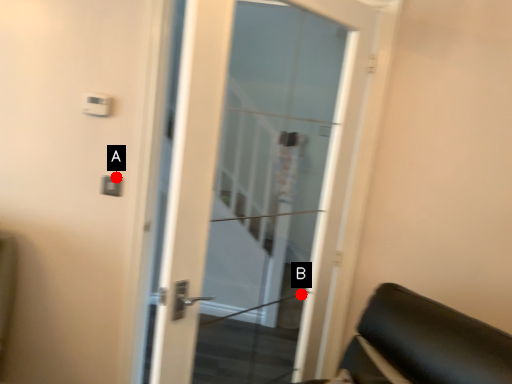
Question: Two points are circled on the image, labeled by A and B beside each circle. Which of the following is the closest to the observer?

Choices:
 (A) A is closer
 (B) B is closer

Answer: (A)